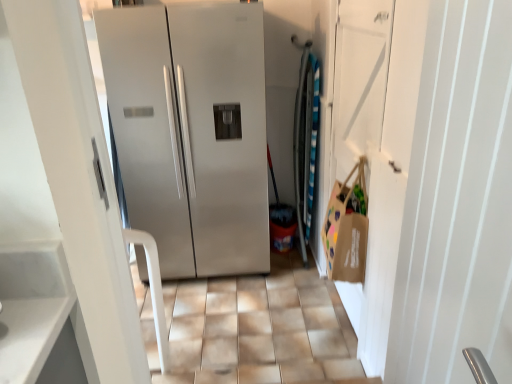
Question: Is brown paper bag at right oriented towards satin silver refrigerator at center?

Choices:
 (A) no
 (B) yes

Answer: (A)

Question: Considering the relative sizes of brown paper bag at right and satin silver refrigerator at center in the image provided, is brown paper bag at right thinner than satin silver refrigerator at center?

Choices:
 (A) no
 (B) yes

Answer: (B)

Question: Is brown paper bag at right next to satin silver refrigerator at center?

Choices:
 (A) yes
 (B) no

Answer: (B)

Question: From the image's perspective, is brown paper bag at right below satin silver refrigerator at center?

Choices:
 (A) yes
 (B) no

Answer: (A)

Question: Considering the relative sizes of brown paper bag at right and satin silver refrigerator at center in the image provided, is brown paper bag at right taller than satin silver refrigerator at center?

Choices:
 (A) yes
 (B) no

Answer: (B)

Question: Does point (147, 97) appear closer or farther from the camera than point (351, 253)?

Choices:
 (A) farther
 (B) closer

Answer: (A)

Question: Do you think satin silver refrigerator at center is within brown paper bag at right, or outside of it?

Choices:
 (A) outside
 (B) inside

Answer: (A)

Question: Is satin silver refrigerator at center to the left or to the right of brown paper bag at right in the image?

Choices:
 (A) right
 (B) left

Answer: (B)

Question: Considering their positions, is satin silver refrigerator at center located in front of or behind brown paper bag at right?

Choices:
 (A) behind
 (B) front

Answer: (A)

Question: Is brown paper bag at right in front of or behind satin silver refrigerator at center in the image?

Choices:
 (A) behind
 (B) front

Answer: (B)

Question: From the image's perspective, relative to satin silver refrigerator at center, is brown paper bag at right above or below?

Choices:
 (A) above
 (B) below

Answer: (B)

Question: Looking at the image, does brown paper bag at right seem bigger or smaller compared to satin silver refrigerator at center?

Choices:
 (A) big
 (B) small

Answer: (B)

Question: Is point (386, 157) positioned closer to the camera than point (245, 163)?

Choices:
 (A) farther
 (B) closer

Answer: (B)

Question: From the image's perspective, is satin silver refrigerator at center positioned above or below brown paper bag at right?

Choices:
 (A) below
 (B) above

Answer: (B)

Question: Considering the positions of satin silver refrigerator at center and brown paper bag at right in the image, is satin silver refrigerator at center taller or shorter than brown paper bag at right?

Choices:
 (A) short
 (B) tall

Answer: (B)